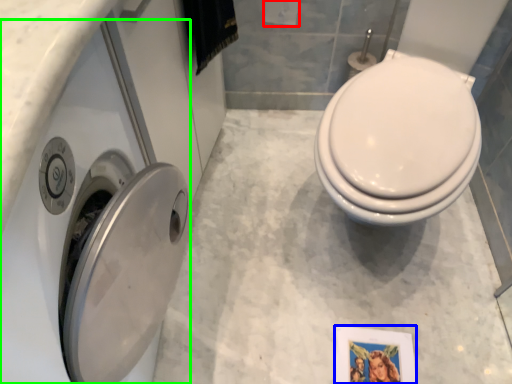
Question: Which is farther away from toilet paper (highlighted by a red box)? picture frame (highlighted by a blue box) or washer (highlighted by a green box)?

Choices:
 (A) picture frame
 (B) washer

Answer: (A)